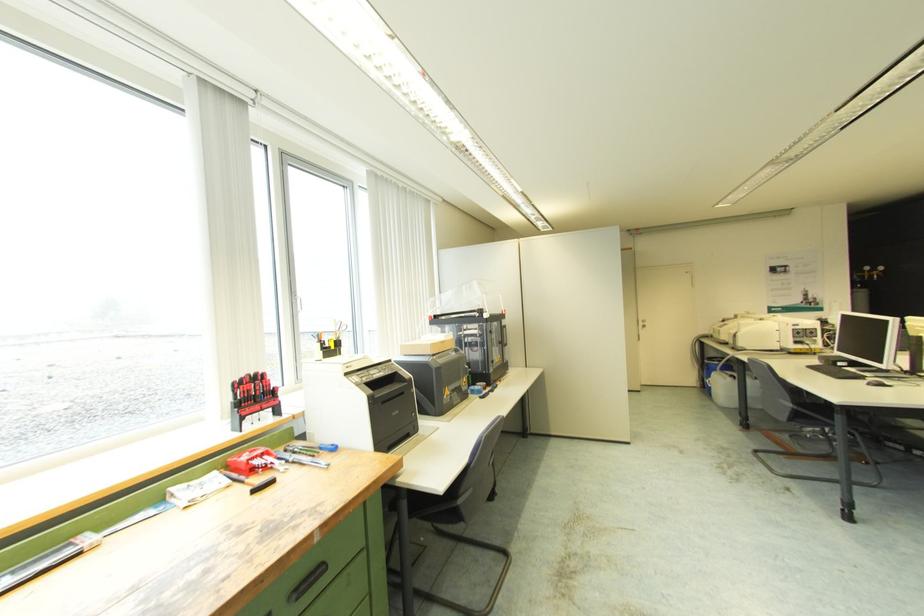
Find where to lift the printer scanner lid. Please return your answer as a coordinate pair (x, y).

(487, 309)